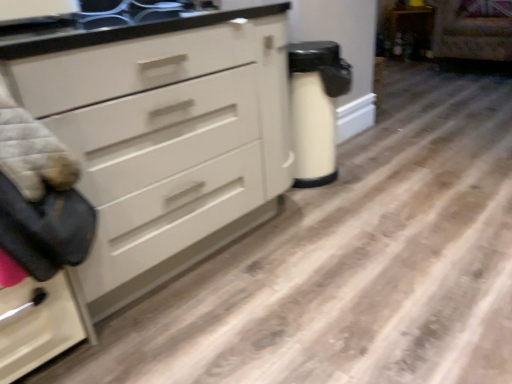
Question: Does velvet-like beige armchair at upper right lie behind wooden cabinet at upper right?

Choices:
 (A) no
 (B) yes

Answer: (A)

Question: From a real-world perspective, does velvet-like beige armchair at upper right sit lower than wooden cabinet at upper right?

Choices:
 (A) no
 (B) yes

Answer: (A)

Question: Is velvet-like beige armchair at upper right oriented away from wooden cabinet at upper right?

Choices:
 (A) no
 (B) yes

Answer: (A)

Question: From the image's perspective, is velvet-like beige armchair at upper right on wooden cabinet at upper right?

Choices:
 (A) no
 (B) yes

Answer: (A)

Question: Is velvet-like beige armchair at upper right wider than wooden cabinet at upper right?

Choices:
 (A) no
 (B) yes

Answer: (B)

Question: From a real-world perspective, is velvet-like beige armchair at upper right positioned over wooden cabinet at upper right based on gravity?

Choices:
 (A) yes
 (B) no

Answer: (A)

Question: From the image's perspective, is black glossy sink at upper center on white matte chest of drawers at center?

Choices:
 (A) no
 (B) yes

Answer: (B)

Question: Is black glossy sink at upper center facing towards white matte chest of drawers at center?

Choices:
 (A) yes
 (B) no

Answer: (A)

Question: Can you confirm if black glossy sink at upper center is shorter than white matte chest of drawers at center?

Choices:
 (A) yes
 (B) no

Answer: (A)

Question: Is black glossy sink at upper center outside of white matte chest of drawers at center?

Choices:
 (A) no
 (B) yes

Answer: (A)

Question: Considering the relative positions of black glossy sink at upper center and white matte chest of drawers at center in the image provided, is black glossy sink at upper center to the left of white matte chest of drawers at center from the viewer's perspective?

Choices:
 (A) yes
 (B) no

Answer: (A)

Question: From the image's perspective, does black glossy sink at upper center appear lower than white matte chest of drawers at center?

Choices:
 (A) no
 (B) yes

Answer: (A)

Question: Does velvet-like beige armchair at upper right have a lesser width compared to white matte chest of drawers at center?

Choices:
 (A) no
 (B) yes

Answer: (A)